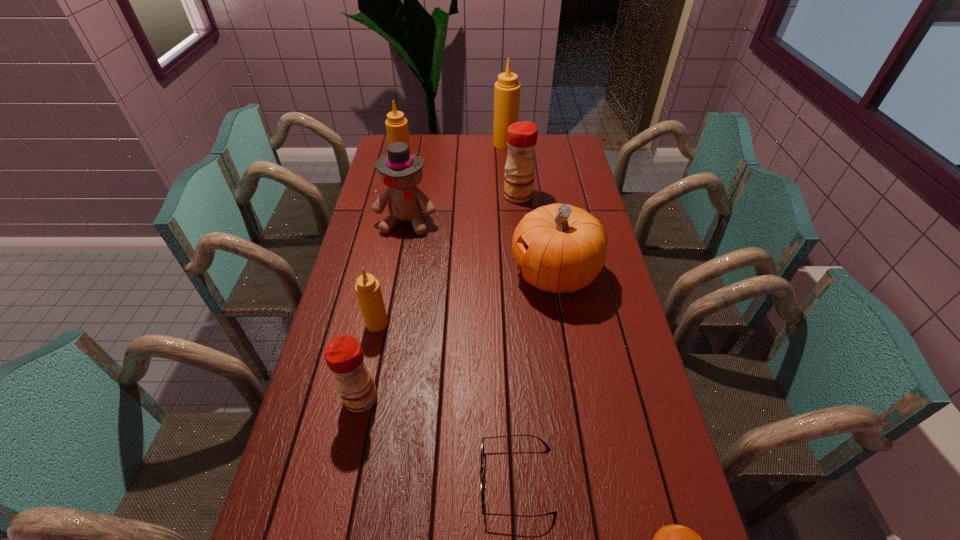
This screenshot has width=960, height=540. What are the coordinates of `the sixth farthest object` in the screenshot? It's located at (367, 287).

The image size is (960, 540). Find the location of `the nearest condiment`. the nearest condiment is located at coordinates (344, 356).

The image size is (960, 540). I want to click on the left red condiment, so click(x=344, y=356).

Identify the location of spectacles. This screenshot has width=960, height=540. (482, 445).

In order to click on the second nearest object in this screenshot , I will do `click(482, 445)`.

Locate an element on the screen. The image size is (960, 540). vacant area situated 0.370m on the left of the biggest tan condiment is located at coordinates (412, 144).

Where is `free spot located on the left of the second biggest tan condiment`? Image resolution: width=960 pixels, height=540 pixels. free spot located on the left of the second biggest tan condiment is located at coordinates (378, 170).

At what (x,y) coordinates should I click in order to perform the action: click on free spot located on the right of the seventh nearest object. Please return your answer as a coordinate pair (x, y). Looking at the image, I should click on (573, 195).

Where is `vacant space located on the front-facing side of the rag_doll`? The height and width of the screenshot is (540, 960). vacant space located on the front-facing side of the rag_doll is located at coordinates (390, 314).

At what (x,y) coordinates should I click in order to perform the action: click on free space located 0.360m on the front-facing side of the orange pumpkin. Please return your answer as a coordinate pair (x, y). The image size is (960, 540). Looking at the image, I should click on (399, 274).